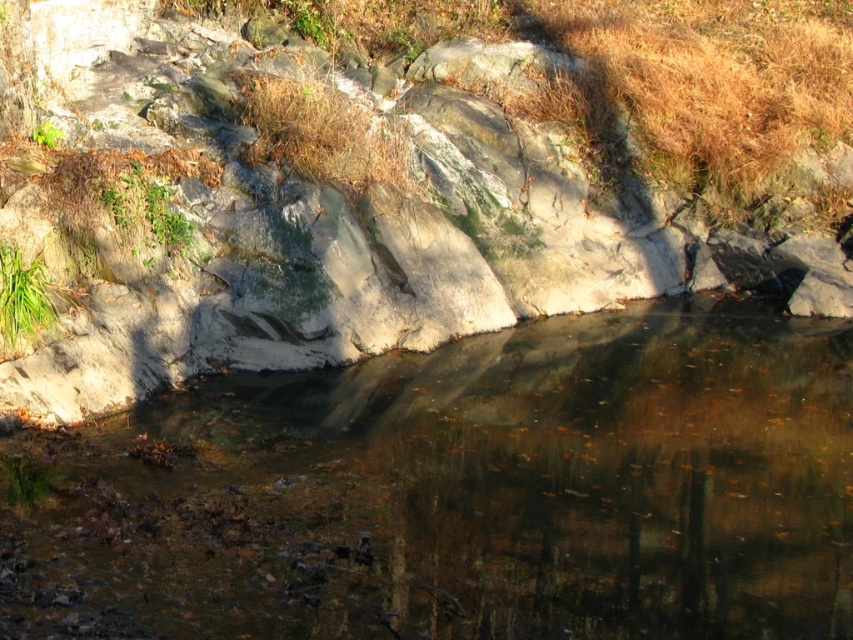
Question: Which of the following is the closest to the observer?

Choices:
 (A) pyautogui.click(x=192, y=460)
 (B) pyautogui.click(x=334, y=355)
 (C) pyautogui.click(x=16, y=280)

Answer: (A)

Question: Where is rough stone hillside at upper center located in relation to green grass at lower left in the image?

Choices:
 (A) below
 (B) above

Answer: (B)

Question: Which object is farther from the camera taking this photo?

Choices:
 (A) green grass at lower left
 (B) clear water at center
 (C) rough stone hillside at upper center

Answer: (A)

Question: Is rough stone hillside at upper center bigger than green grass at lower left?

Choices:
 (A) no
 (B) yes

Answer: (B)

Question: Which point is closer to the camera taking this photo?

Choices:
 (A) (44, 280)
 (B) (688, 326)

Answer: (A)

Question: Can you confirm if clear water at center is thinner than green grass at lower left?

Choices:
 (A) yes
 (B) no

Answer: (B)